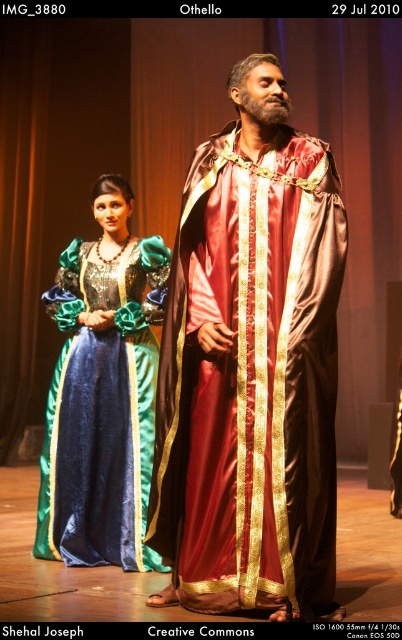
Question: Which of the following is the farthest from the observer?

Choices:
 (A) (217, 244)
 (B) (114, 541)

Answer: (B)

Question: Is satin gold robe at center smaller than velvet green dress at center?

Choices:
 (A) yes
 (B) no

Answer: (B)

Question: Does satin gold robe at center appear under velvet green dress at center?

Choices:
 (A) yes
 (B) no

Answer: (B)

Question: Among these objects, which one is farthest from the camera?

Choices:
 (A) satin gold robe at center
 (B) velvet green dress at center

Answer: (B)

Question: Can you confirm if satin gold robe at center is positioned above velvet green dress at center?

Choices:
 (A) no
 (B) yes

Answer: (B)